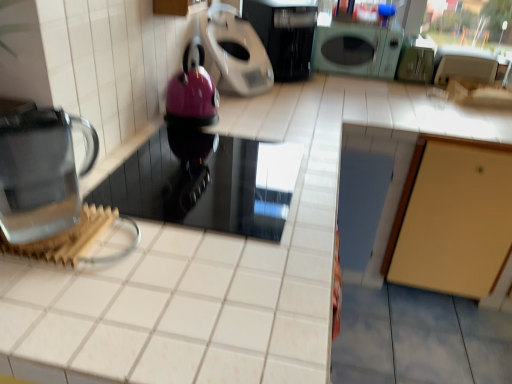
At what (x,y) coordinates should I click in order to perform the action: click on free location above transparent glass kettle at left (from a real-world perspective). Please return your answer as a coordinate pair (x, y). Looking at the image, I should click on [28, 118].